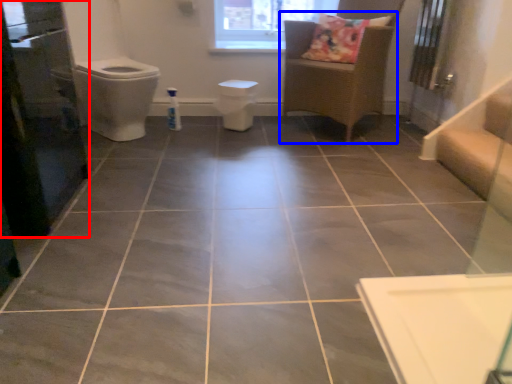
Question: Which point is further to the camera, screen door (highlighted by a red box) or furniture (highlighted by a blue box)?

Choices:
 (A) screen door
 (B) furniture

Answer: (B)